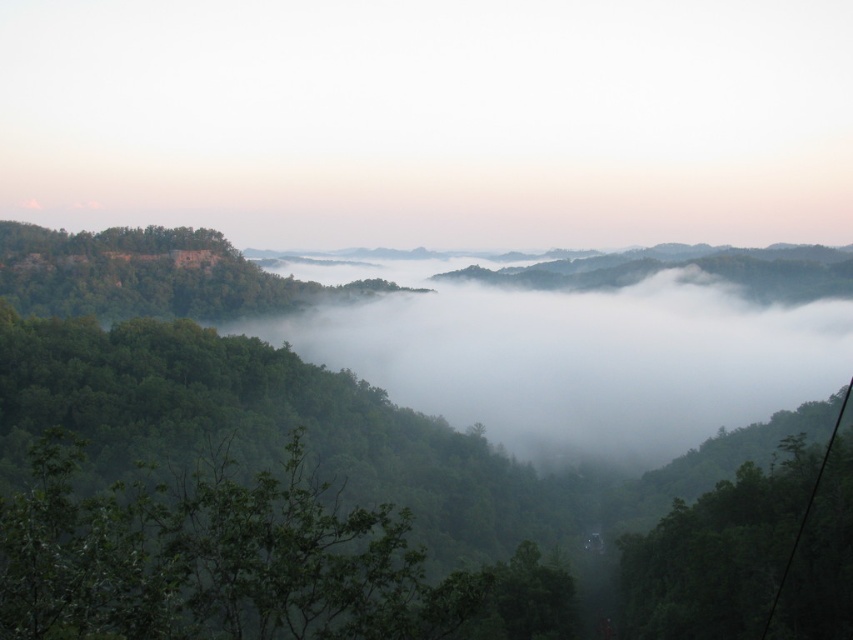
Based on the photo, does green leafy tree at center have a greater width compared to black wire at lower right?

No.

Is green leafy tree at center smaller than black wire at lower right?

Yes, green leafy tree at center is smaller than black wire at lower right.

Is point (201, 602) in front of point (814, 497)?

Yes, it is.

Identify the location of green leafy tree at center. This screenshot has width=853, height=640. (213, 557).